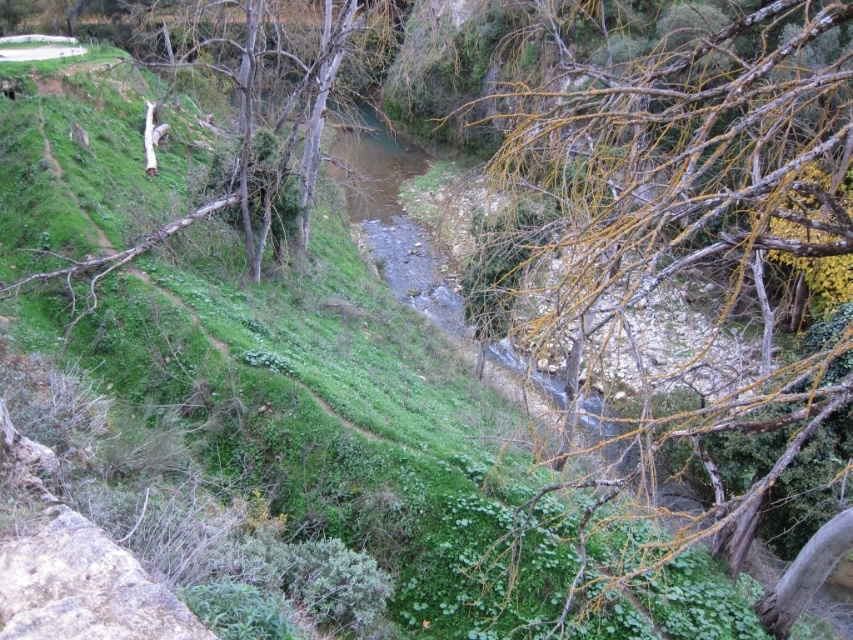
You are standing at the point with coordinates point (x=717, y=106) and want to walk towards the point with coordinates point (x=245, y=177). Based on the scene description, will you have to climb uphill or walk downhill?

Since point (x=717, y=106) is in front of point (x=245, y=177), you will have to climb uphill to reach the point (x=245, y=177) from your current position.